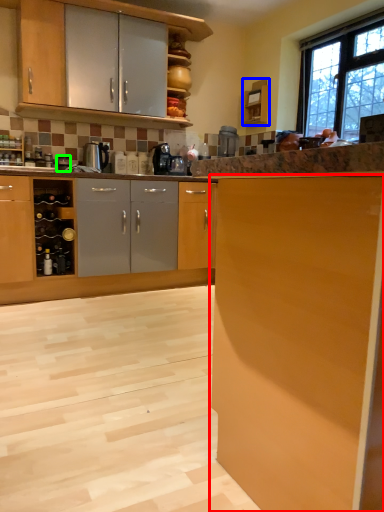
Question: Which is farther away from cabinetry (highlighted by a red box)? cabinetry (highlighted by a blue box) or appliance (highlighted by a green box)?

Choices:
 (A) cabinetry
 (B) appliance

Answer: (A)